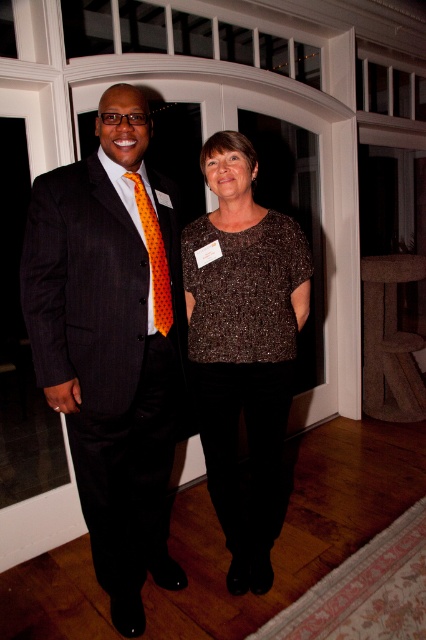
Question: Which point appears closest to the camera in this image?

Choices:
 (A) (154, 264)
 (B) (256, 342)
 (C) (115, 109)

Answer: (C)

Question: Is the position of sparkly brown blouse at center less distant than that of orange dotted tie at left?

Choices:
 (A) no
 (B) yes

Answer: (A)

Question: Which of the following is the farthest from the observer?

Choices:
 (A) orange dotted tie at left
 (B) sparkly brown blouse at center
 (C) matte black suit at left

Answer: (B)

Question: Does matte black suit at left appear on the left side of sparkly brown blouse at center?

Choices:
 (A) no
 (B) yes

Answer: (B)

Question: Does matte black suit at left have a larger size compared to sparkly brown blouse at center?

Choices:
 (A) yes
 (B) no

Answer: (A)

Question: Which object appears farthest from the camera in this image?

Choices:
 (A) orange dotted tie at left
 (B) matte black suit at left
 (C) sparkly brown blouse at center

Answer: (C)